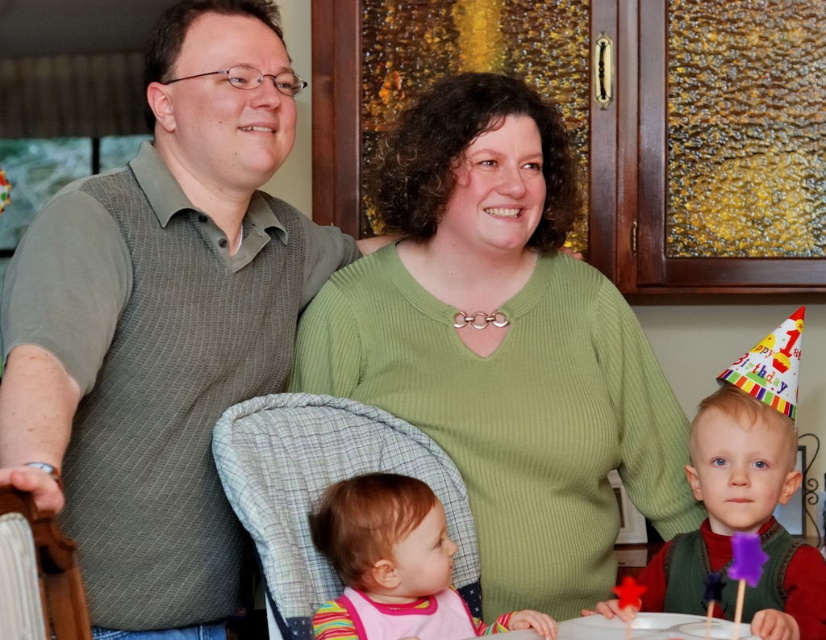
Which is below, matte green vest at center or wooden chair at left?

matte green vest at center

Can you confirm if matte green vest at center is smaller than wooden chair at left?

Actually, matte green vest at center might be larger than wooden chair at left.

Which is in front, point (717, 486) or point (27, 563)?

Point (27, 563) is more forward.

The image size is (826, 640). Identify the location of matte green vest at center. (743, 518).

Who is lower down, matte gray vest at center or plaid fabric baby carrier at center?

plaid fabric baby carrier at center is below.

Does matte gray vest at center appear over plaid fabric baby carrier at center?

Yes.

Is point (229, 378) positioned before point (330, 451)?

Yes, it is in front of point (330, 451).

Identify the location of matte gray vest at center. (162, 324).

Can you confirm if matte gray vest at center is positioned to the left of green ribbed sweater at center?

Correct, you'll find matte gray vest at center to the left of green ribbed sweater at center.

Who is higher up, matte gray vest at center or green ribbed sweater at center?

matte gray vest at center

Identify the location of matte gray vest at center. (162, 324).